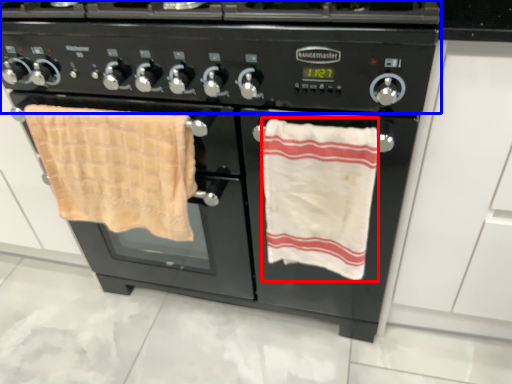
Question: Which of the following is the closest to the observer, beach towel (highlighted by a red box) or gas stove (highlighted by a blue box)?

Choices:
 (A) beach towel
 (B) gas stove

Answer: (B)